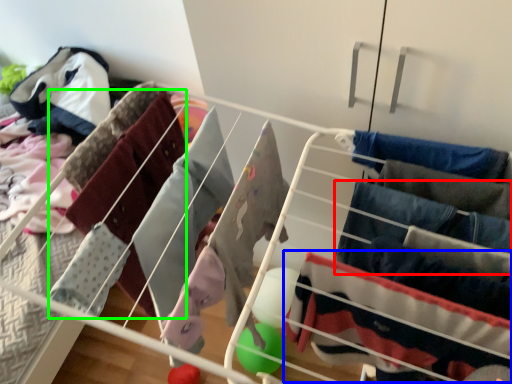
Question: Which object is the closest to the clothing (highlighted by a red box)? Choose among these: clothing (highlighted by a blue box) or clothing (highlighted by a green box).

Choices:
 (A) clothing
 (B) clothing

Answer: (A)